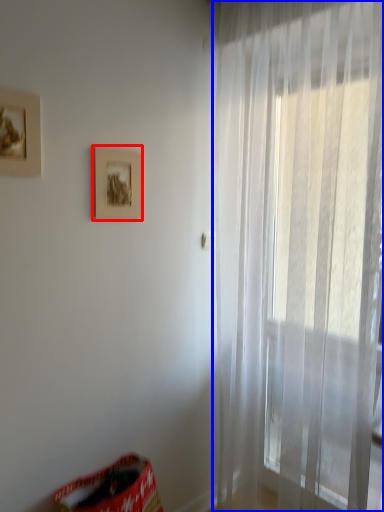
Question: Which of the following is the closest to the observer, picture frame (highlighted by a red box) or curtain (highlighted by a blue box)?

Choices:
 (A) picture frame
 (B) curtain

Answer: (B)